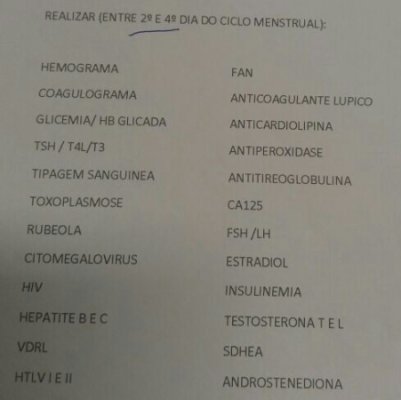
Identify the location of fan. The width and height of the screenshot is (401, 400). (236, 72).